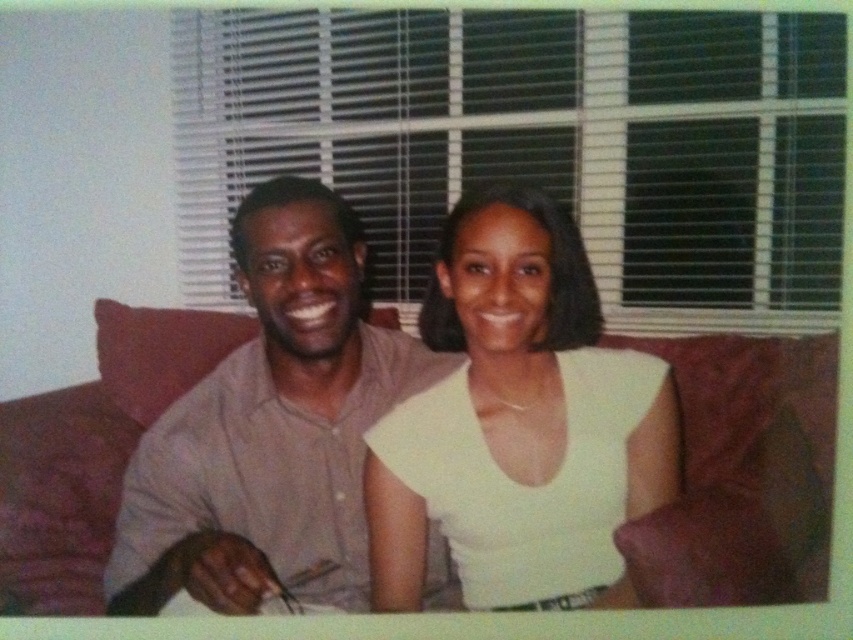
Image resolution: width=853 pixels, height=640 pixels. What do you see at coordinates (518, 422) in the screenshot?
I see `white matte shirt at center` at bounding box center [518, 422].

Which is above, white matte shirt at center or matte gray shirt at center?

matte gray shirt at center

Which is in front, point (476, 420) or point (367, 412)?

Point (476, 420)

Find the location of a particular element. white matte shirt at center is located at coordinates (518, 422).

Which is below, brown leather couch at center or matte gray shirt at center?

brown leather couch at center

Does brown leather couch at center appear over matte gray shirt at center?

Incorrect, brown leather couch at center is not positioned above matte gray shirt at center.

At what (x,y) coordinates should I click in order to perform the action: click on brown leather couch at center. Please return your answer as a coordinate pair (x, y). This screenshot has width=853, height=640. Looking at the image, I should click on point(743,474).

Does white matte shirt at center have a lesser width compared to brown leather couch at center?

Indeed, white matte shirt at center has a lesser width compared to brown leather couch at center.

Does white matte shirt at center have a larger size compared to brown leather couch at center?

Incorrect, white matte shirt at center is not larger than brown leather couch at center.

This screenshot has width=853, height=640. What do you see at coordinates (518, 422) in the screenshot? I see `white matte shirt at center` at bounding box center [518, 422].

Image resolution: width=853 pixels, height=640 pixels. What are the coordinates of `white matte shirt at center` in the screenshot? It's located at (518, 422).